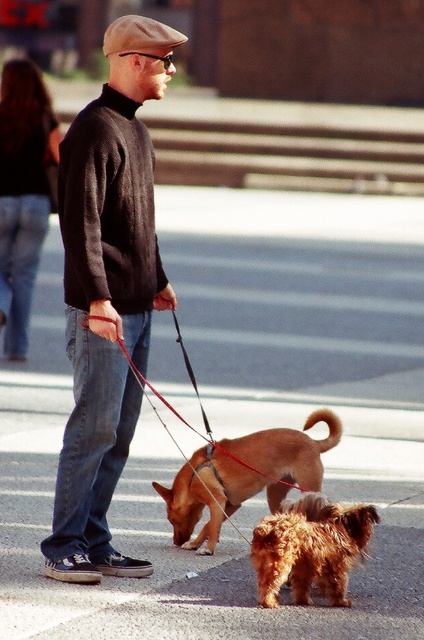
Question: Which of the following is the closest to the observer?

Choices:
 (A) brown furry dog at center
 (B) fuzzy brown dog at lower center
 (C) dark gray sweater at center
 (D) brushed metal dog at center

Answer: (B)

Question: Can you confirm if brushed metal dog at center is positioned to the right of brown furry dog at center?

Choices:
 (A) yes
 (B) no

Answer: (B)

Question: Does dark gray sweater at center appear over brushed metal dog at center?

Choices:
 (A) no
 (B) yes

Answer: (A)

Question: Can you confirm if brushed metal dog at center is smaller than fuzzy brown dog at lower center?

Choices:
 (A) no
 (B) yes

Answer: (A)

Question: Which point is farther to the camera?

Choices:
 (A) (116, 198)
 (B) (144, 390)
 (C) (310, 468)

Answer: (C)

Question: Which point is farther to the camera?

Choices:
 (A) (75, 330)
 (B) (144, 378)
 (C) (292, 541)
 (D) (164, 493)

Answer: (D)